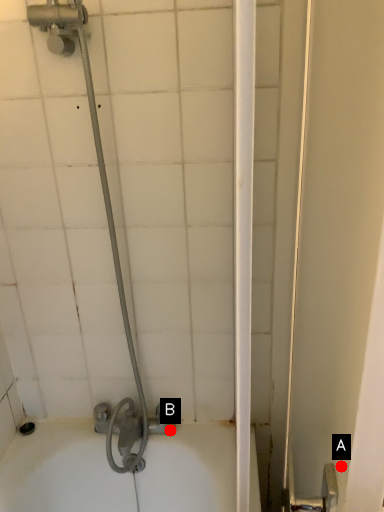
Question: Two points are circled on the image, labeled by A and B beside each circle. Which point is farther to the camera?

Choices:
 (A) A is further
 (B) B is further

Answer: (B)